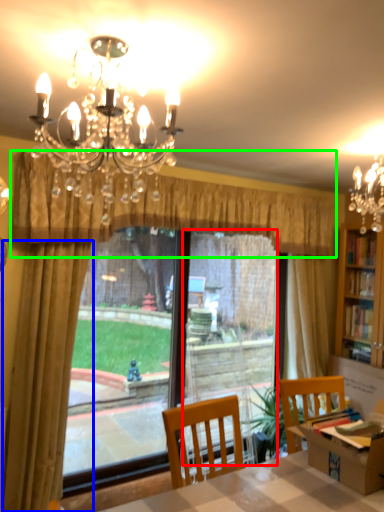
Question: Which object is the closest to the screen door (highlighted by a red box)? Choose among these: curtain (highlighted by a blue box) or curtain (highlighted by a green box).

Choices:
 (A) curtain
 (B) curtain

Answer: (B)